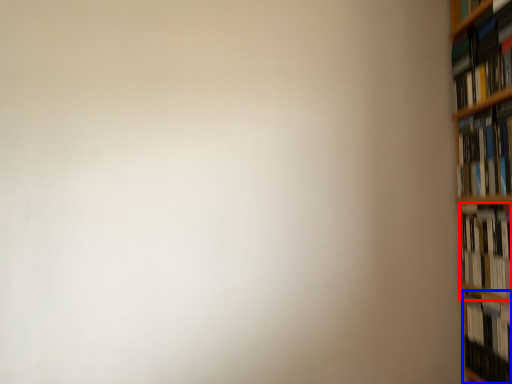
Question: Which point is further to the camera, book (highlighted by a red box) or book (highlighted by a blue box)?

Choices:
 (A) book
 (B) book

Answer: (B)